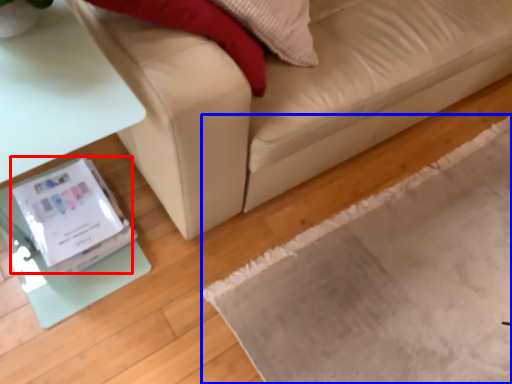
Question: Which object is further to the camera taking this photo, Wii (highlighted by a red box) or mat (highlighted by a blue box)?

Choices:
 (A) Wii
 (B) mat

Answer: (A)